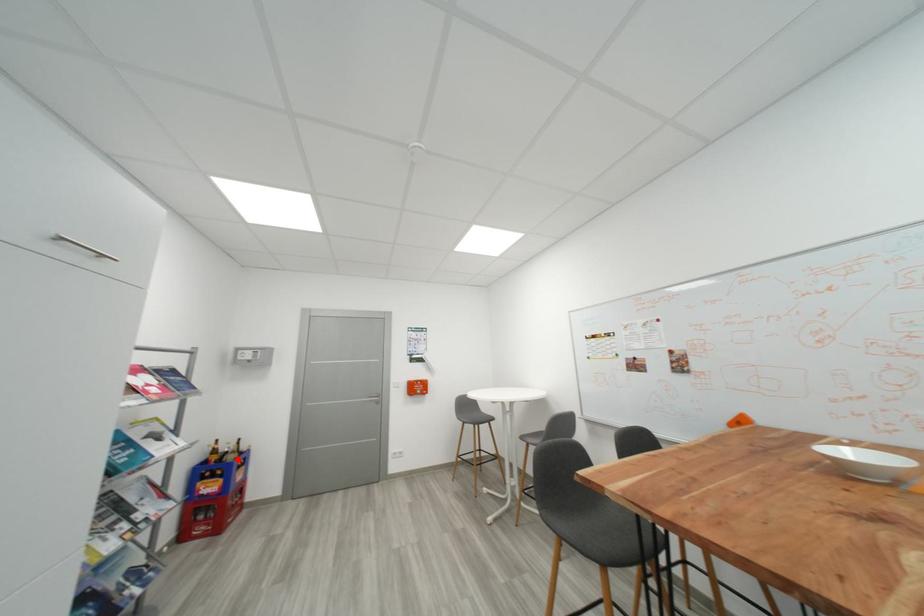
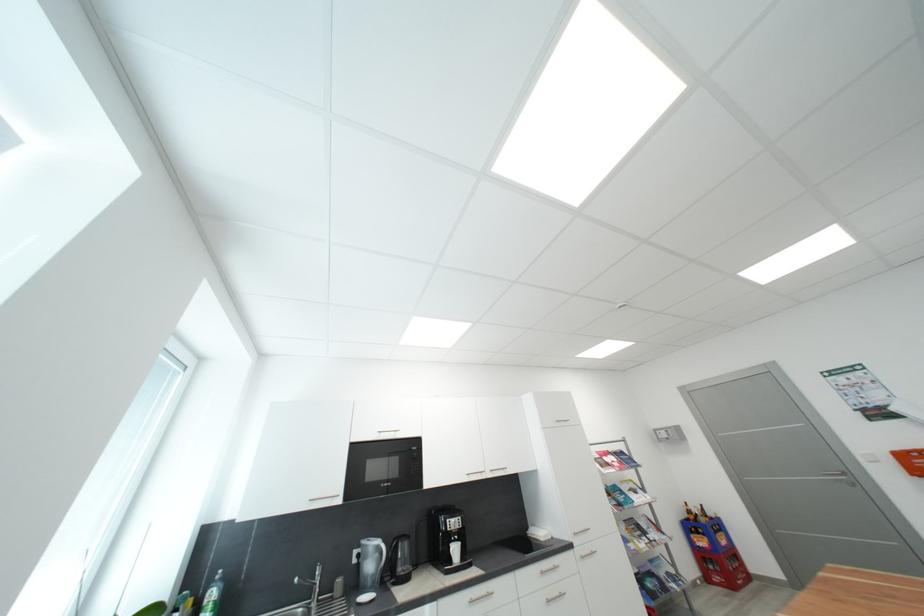
Question: I am providing you with two images of the same scene from different viewpoints. A red point is shown in image1. For the corresponding object point in image2, is it positioned nearer or farther from the camera?

Choices:
 (A) Nearer
 (B) Farther

Answer: (A)